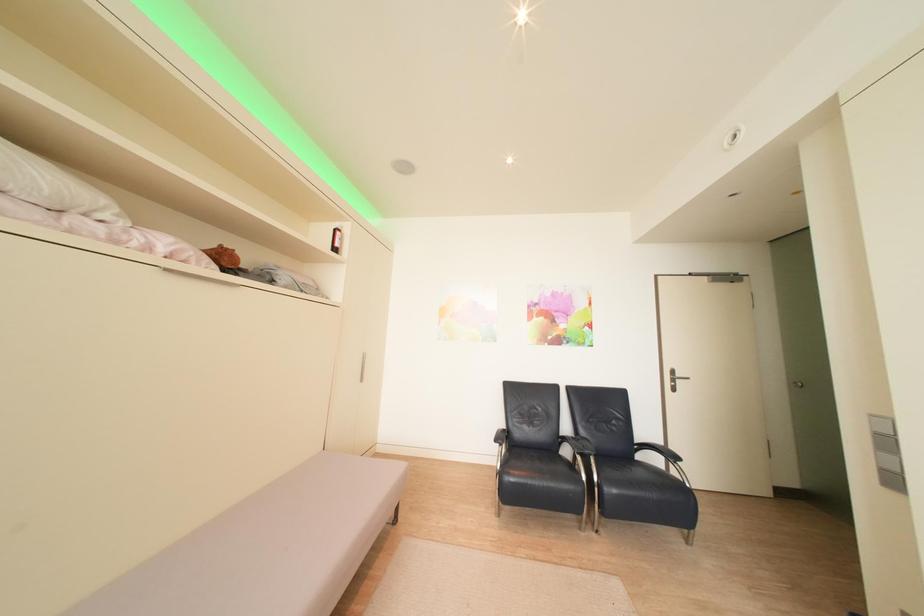
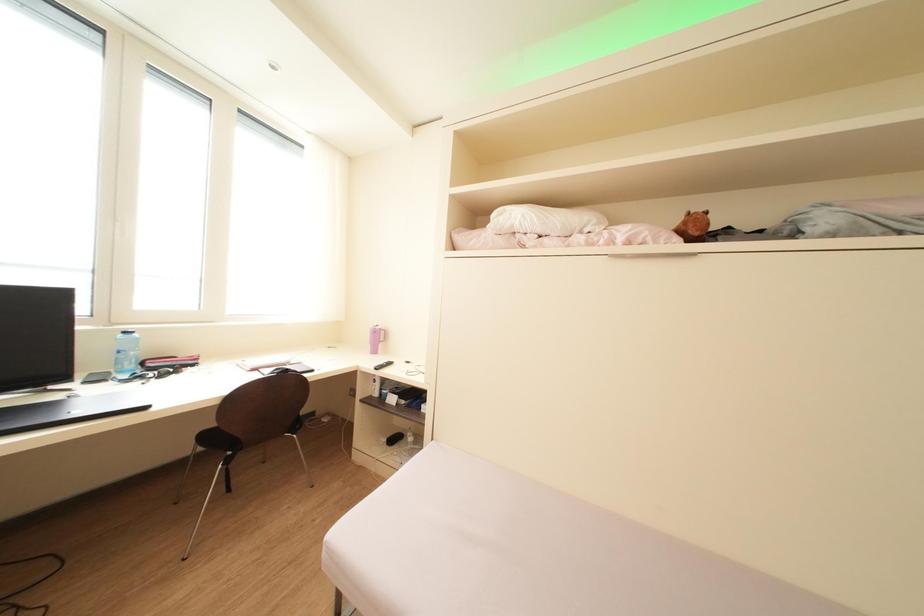
Question: The camera is either moving clockwise (left) or counter-clockwise (right) around the object. The first image is from the beginning of the video and the second image is from the end. Is the camera moving left or right when shooting the video?

Choices:
 (A) Left
 (B) Right

Answer: (B)